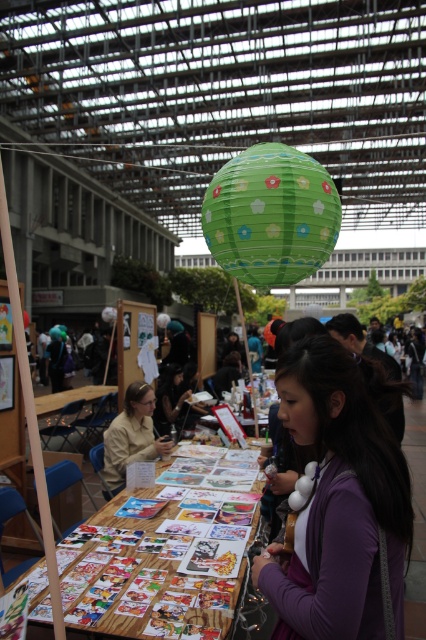
Can you confirm if purple matte jacket at center is taller than matte beige shirt at center?

Yes, purple matte jacket at center is taller than matte beige shirt at center.

Is purple matte jacket at center to the left of matte beige shirt at center from the viewer's perspective?

Incorrect, purple matte jacket at center is not on the left side of matte beige shirt at center.

The image size is (426, 640). What are the coordinates of `purple matte jacket at center` in the screenshot? It's located at (339, 500).

Which is above, purple matte jacket at center or green paper lantern at center?

green paper lantern at center is above.

Measure the distance from purple matte jacket at center to green paper lantern at center.

They are 4.59 feet apart.

Which is behind, point (359, 627) or point (282, 243)?

The point (282, 243) is more distant.

The width and height of the screenshot is (426, 640). I want to click on purple matte jacket at center, so click(x=339, y=500).

Which is above, printed paper cards at center or matte beige shirt at center?

matte beige shirt at center is higher up.

Which is more to the right, printed paper cards at center or matte beige shirt at center?

Positioned to the right is printed paper cards at center.

The height and width of the screenshot is (640, 426). What do you see at coordinates (152, 570) in the screenshot?
I see `printed paper cards at center` at bounding box center [152, 570].

Locate an element on the screen. The image size is (426, 640). printed paper cards at center is located at coordinates (152, 570).